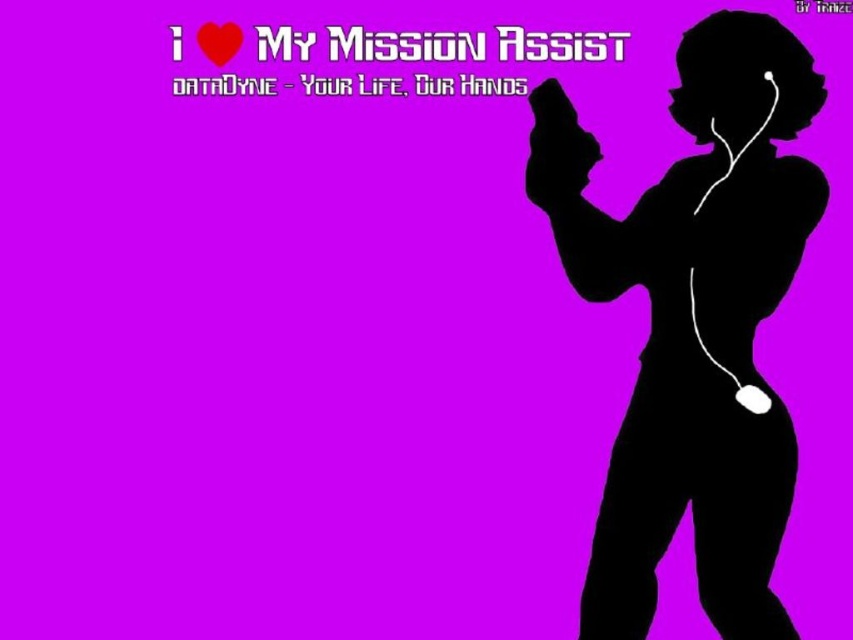
Question: Which point appears closest to the camera in this image?

Choices:
 (A) (219, 45)
 (B) (727, 566)

Answer: (B)

Question: Where is black silhouette at right located in relation to red matte heart at upper left in the image?

Choices:
 (A) left
 (B) right

Answer: (B)

Question: Is black silhouette at right to the left of red matte heart at upper left from the viewer's perspective?

Choices:
 (A) no
 (B) yes

Answer: (A)

Question: Is black silhouette at right positioned behind red matte heart at upper left?

Choices:
 (A) yes
 (B) no

Answer: (B)